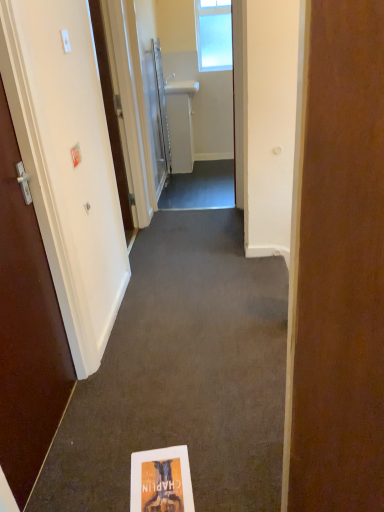
Question: Which direction should I rotate to look at white glossy towel rack at upper center, the 1th door viewed from the back, — up or down?

Choices:
 (A) up
 (B) down

Answer: (A)

Question: Is white paper book at center facing towards clear glass window at upper center?

Choices:
 (A) yes
 (B) no

Answer: (B)

Question: From a real-world perspective, is white paper book at center over clear glass window at upper center?

Choices:
 (A) yes
 (B) no

Answer: (B)

Question: Is white paper book at center smaller than clear glass window at upper center?

Choices:
 (A) yes
 (B) no

Answer: (B)

Question: From the image's perspective, is white paper book at center over clear glass window at upper center?

Choices:
 (A) no
 (B) yes

Answer: (A)

Question: Is clear glass window at upper center located within white paper book at center?

Choices:
 (A) yes
 (B) no

Answer: (B)

Question: Is the depth of white paper book at center less than that of clear glass window at upper center?

Choices:
 (A) yes
 (B) no

Answer: (A)

Question: Can you confirm if clear glass window at upper center is shorter than white matte door at left, arranged as the 3th door when viewed from the front?

Choices:
 (A) yes
 (B) no

Answer: (A)

Question: From a real-world perspective, is clear glass window at upper center beneath white matte door at left, arranged as the 3th door when viewed from the front?

Choices:
 (A) no
 (B) yes

Answer: (A)

Question: From the image's perspective, is clear glass window at upper center on top of white matte door at left, arranged as the 3th door when viewed from the front?

Choices:
 (A) no
 (B) yes

Answer: (B)

Question: From a real-world perspective, is clear glass window at upper center on top of white matte door at left, arranged as the 3th door when viewed from the front?

Choices:
 (A) no
 (B) yes

Answer: (B)

Question: Are clear glass window at upper center and white matte door at left, arranged as the 3th door when viewed from the front, far apart?

Choices:
 (A) no
 (B) yes

Answer: (B)

Question: Is clear glass window at upper center turned away from white matte door at left, which appears as the 2th door when viewed from the back?

Choices:
 (A) yes
 (B) no

Answer: (B)

Question: Is white glossy door at left, which appears as the 1th door when viewed from the front, completely or partially inside white paper book at center?

Choices:
 (A) no
 (B) yes

Answer: (A)